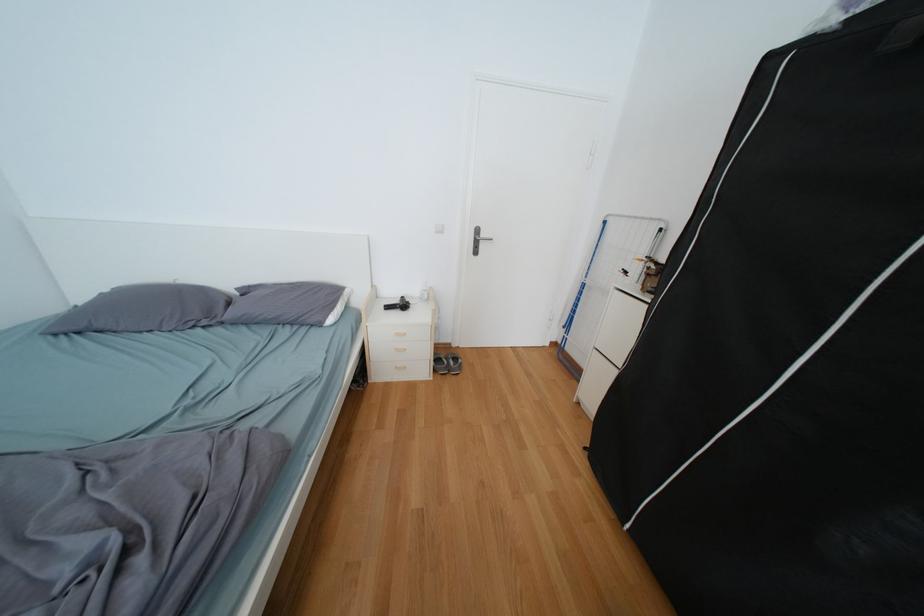
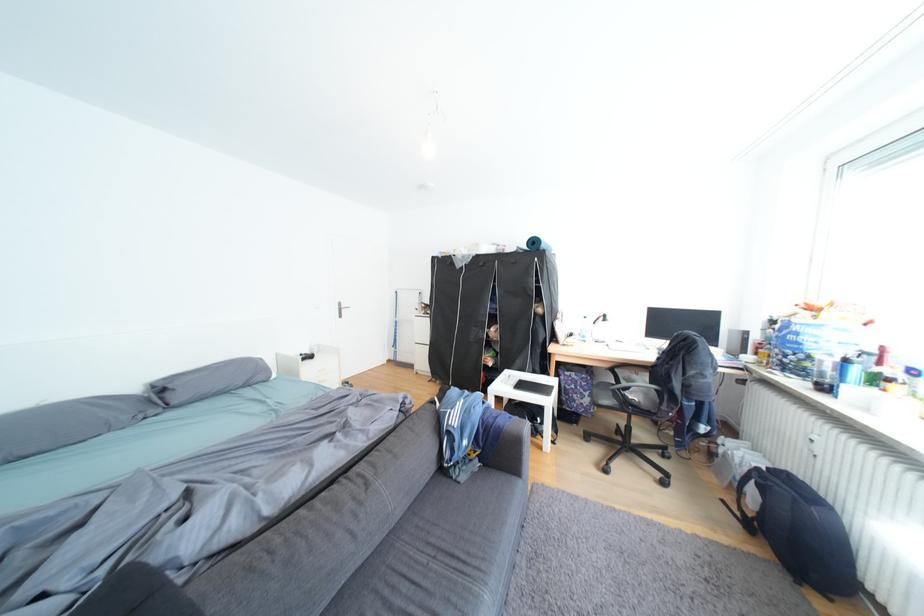
In the second image, find the point that corresponds to point (262, 288) in the first image.

(177, 379)